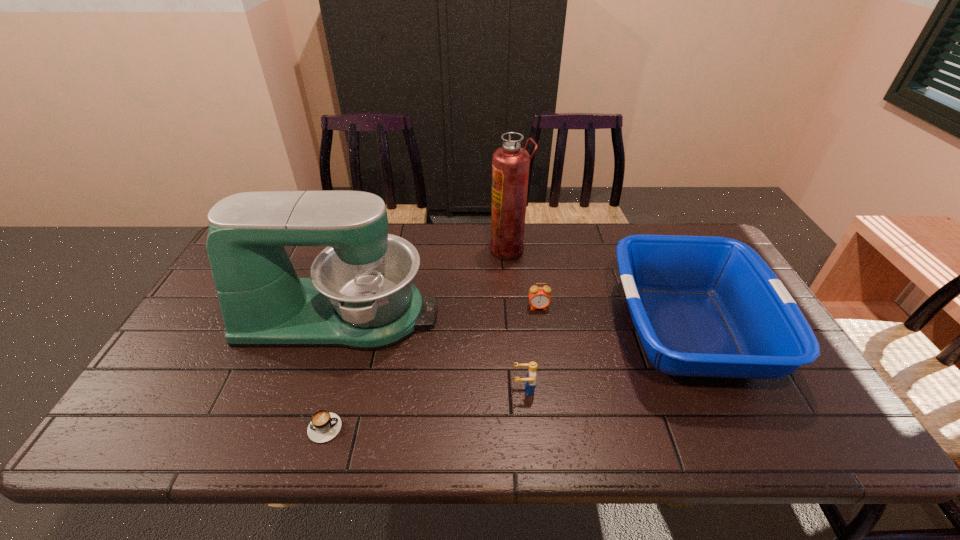
Identify the location of vacant region between the rightmost object and the alarm clock. Image resolution: width=960 pixels, height=540 pixels. (613, 319).

At what (x,y) coordinates should I click in order to perform the action: click on vacant space that's between the nearest object and the farthest object. Please return your answer as a coordinate pair (x, y). This screenshot has width=960, height=540. Looking at the image, I should click on (414, 339).

Where is `blank region between the tray and the Lego`? The height and width of the screenshot is (540, 960). blank region between the tray and the Lego is located at coordinates (606, 360).

At what (x,y) coordinates should I click in order to perform the action: click on free area in between the nearest object and the fourth shortest object. Please return your answer as a coordinate pair (x, y). Image resolution: width=960 pixels, height=540 pixels. Looking at the image, I should click on (503, 379).

Where is `free point between the farthest object and the Lego`? free point between the farthest object and the Lego is located at coordinates (516, 319).

Locate an element on the screen. object that ranks as the closest to the tray is located at coordinates (539, 297).

Identify the location of the fourth closest object to the shortest object. The height and width of the screenshot is (540, 960). (510, 163).

The width and height of the screenshot is (960, 540). I want to click on free spot that satisfies the following two spatial constraints: 1. on the front-facing side of the fourth shortest object; 2. on the right side of the mixer, so click(x=335, y=330).

Find the location of a particular element. vacant position in the image that satisfies the following two spatial constraints: 1. on the face of the fourth shortest object; 2. on the left side of the alarm clock is located at coordinates pyautogui.click(x=541, y=330).

This screenshot has height=540, width=960. I want to click on blank area in the image that satisfies the following two spatial constraints: 1. on the face of the alarm clock; 2. on the face of the Lego, so pyautogui.click(x=550, y=389).